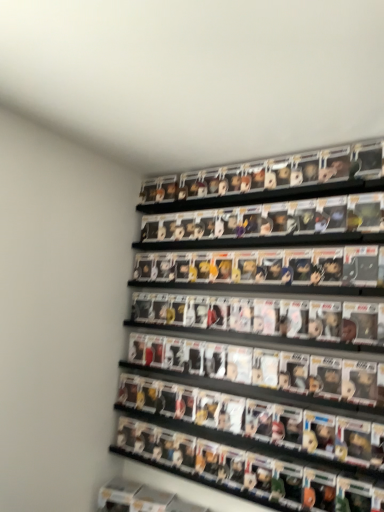
At what (x,y) coordinates should I click in order to perform the action: click on clear plastic figures at center. Please return your answer as a coordinate pair (x, y). Looking at the image, I should click on (265, 319).

What do you see at coordinates (265, 319) in the screenshot? This screenshot has height=512, width=384. I see `clear plastic figures at center` at bounding box center [265, 319].

What are the coordinates of `clear plastic figures at center` in the screenshot? It's located at (265, 319).